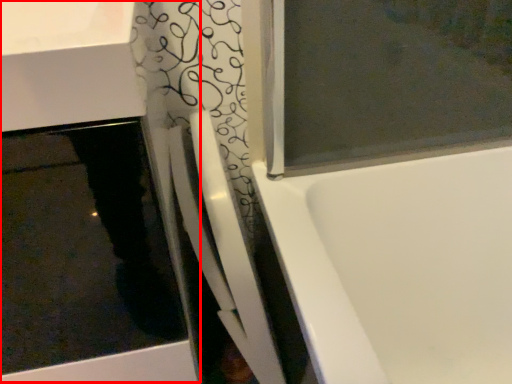
Question: From the image, what is the correct spatial relationship of sink (annotated by the red box) in relation to shower door?

Choices:
 (A) right
 (B) left

Answer: (B)